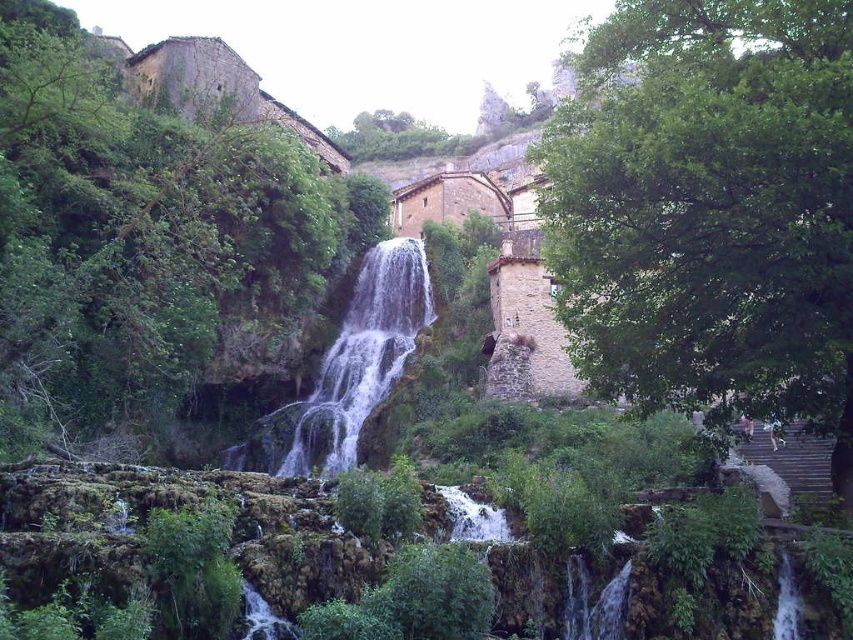
You are standing at the edge of the waterfall and notice a green leafy tree at center and a white frothy water at center. Which object is higher in this scene?

The green leafy tree at center is taller than the white frothy water at center, so the green leafy tree at center is higher in this scene.